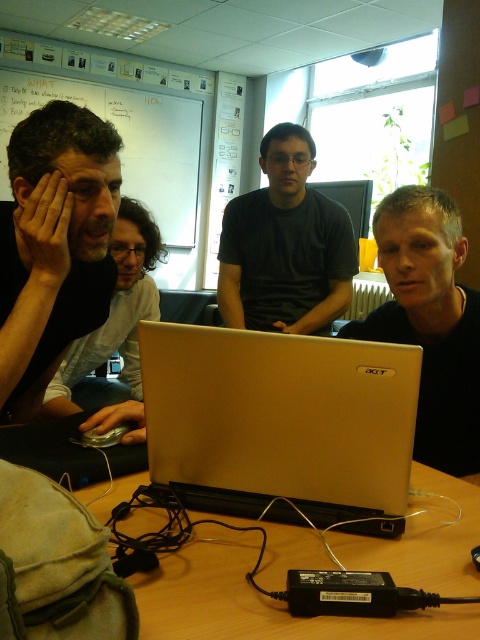
Which is above, matte black laptop at right or dark gray shirt at center?

dark gray shirt at center is above.

Between point (420, 397) and point (288, 164), which one is positioned in front?

Point (420, 397)

Is point (445, 470) in front of point (240, 211)?

Yes, it is in front of point (240, 211).

In order to click on matte black laptop at right in this screenshot , I will do pyautogui.click(x=431, y=321).

Locate an element on the screen. The width and height of the screenshot is (480, 640). satin gold laptop at center is located at coordinates (278, 420).

Does satin gold laptop at center have a greater width compared to dark gray shirt at center?

No, satin gold laptop at center is not wider than dark gray shirt at center.

This screenshot has width=480, height=640. In order to click on satin gold laptop at center in this screenshot , I will do `click(278, 420)`.

Locate an element on the screen. This screenshot has height=640, width=480. satin gold laptop at center is located at coordinates (278, 420).

Between point (137, 602) and point (403, 220), which one is positioned behind?

The point (403, 220) is behind.

Measure the distance between point (206, 584) and camera.

The distance of point (206, 584) from camera is 33.52 inches.

Is point (439, 513) positioned before point (454, 355)?

Yes, point (439, 513) is in front of point (454, 355).

Identify the location of wooden table at lower center. The width and height of the screenshot is (480, 640). (x=259, y=602).